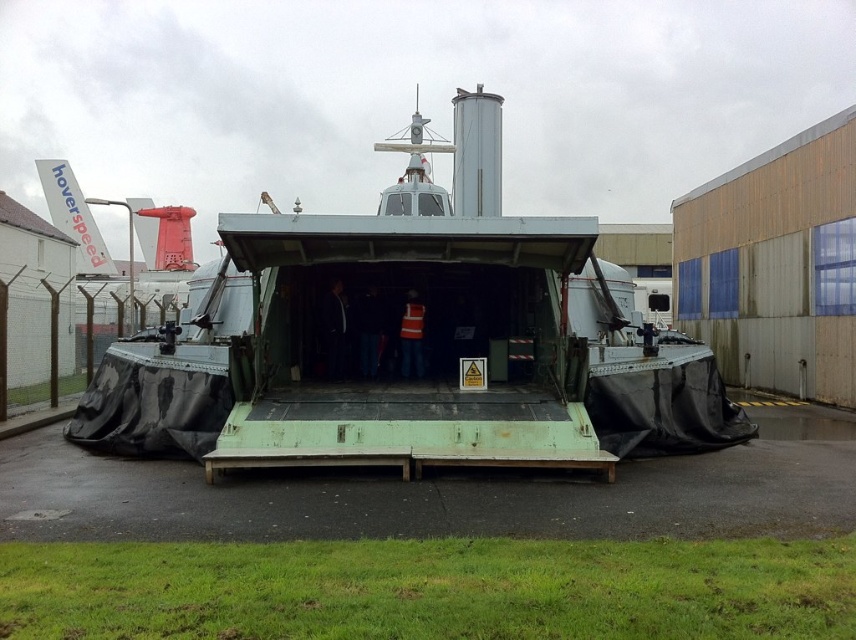
Question: Which of the following is the farthest from the observer?

Choices:
 (A) orange reflective vest at center
 (B) green matte hovercraft at center

Answer: (A)

Question: Which point is closer to the camera?

Choices:
 (A) green matte hovercraft at center
 (B) reflective orange vest at center

Answer: (A)

Question: Is green matte hovercraft at center wider than orange reflective vest at center?

Choices:
 (A) yes
 (B) no

Answer: (A)

Question: Can you confirm if reflective orange vest at center is positioned above orange reflective vest at center?

Choices:
 (A) no
 (B) yes

Answer: (B)

Question: Which object is the closest to the reflective orange vest at center?

Choices:
 (A) green matte hovercraft at center
 (B) orange reflective vest at center

Answer: (B)

Question: Can you confirm if reflective orange vest at center is positioned to the right of orange reflective vest at center?

Choices:
 (A) yes
 (B) no

Answer: (B)